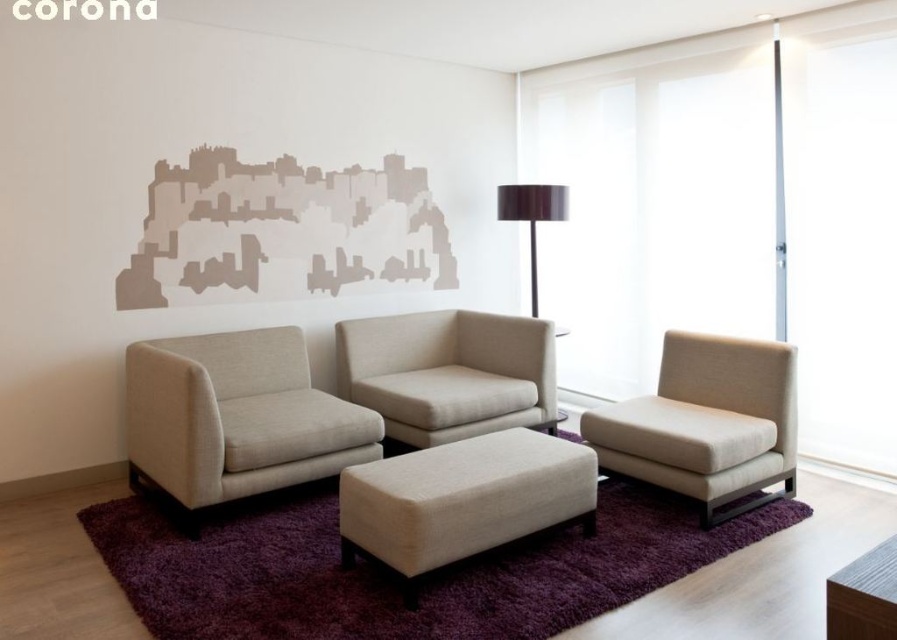
Question: Estimate the real-world distances between objects in this image. Which object is closer to the beige fabric couch at center?

Choices:
 (A) beige fabric ottoman at center
 (B) beige fabric armchair at right
 (C) shiny dark brown lampshade at upper right
 (D) wooden table at lower right

Answer: (C)

Question: Considering the relative positions of beige fabric armchair at center and shiny dark brown lampshade at upper right in the image provided, where is beige fabric armchair at center located with respect to shiny dark brown lampshade at upper right?

Choices:
 (A) right
 (B) left

Answer: (B)

Question: Is beige fabric couch at center thinner than wooden table at lower right?

Choices:
 (A) no
 (B) yes

Answer: (A)

Question: Which point is farther to the camera?

Choices:
 (A) beige fabric armchair at center
 (B) wooden table at lower right
 (C) shiny dark brown lampshade at upper right

Answer: (C)

Question: Considering the relative positions of beige fabric armchair at center and beige fabric armchair at right in the image provided, where is beige fabric armchair at center located with respect to beige fabric armchair at right?

Choices:
 (A) left
 (B) right

Answer: (A)

Question: Estimate the real-world distances between objects in this image. Which object is closer to the shiny dark brown lampshade at upper right?

Choices:
 (A) beige fabric couch at center
 (B) beige fabric armchair at right
 (C) beige fabric armchair at center

Answer: (A)